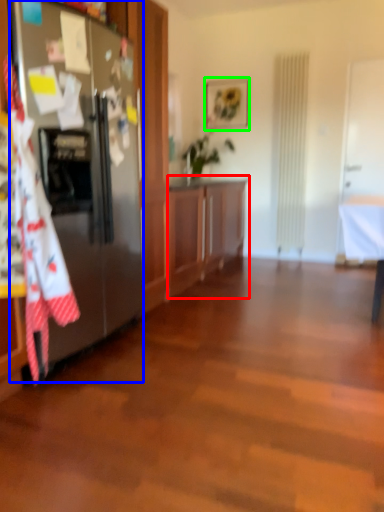
Question: Which object is positioned farthest from cabinetry (highlighted by a red box)? Select from refrigerator (highlighted by a blue box) and picture frame (highlighted by a green box).

Choices:
 (A) refrigerator
 (B) picture frame

Answer: (B)